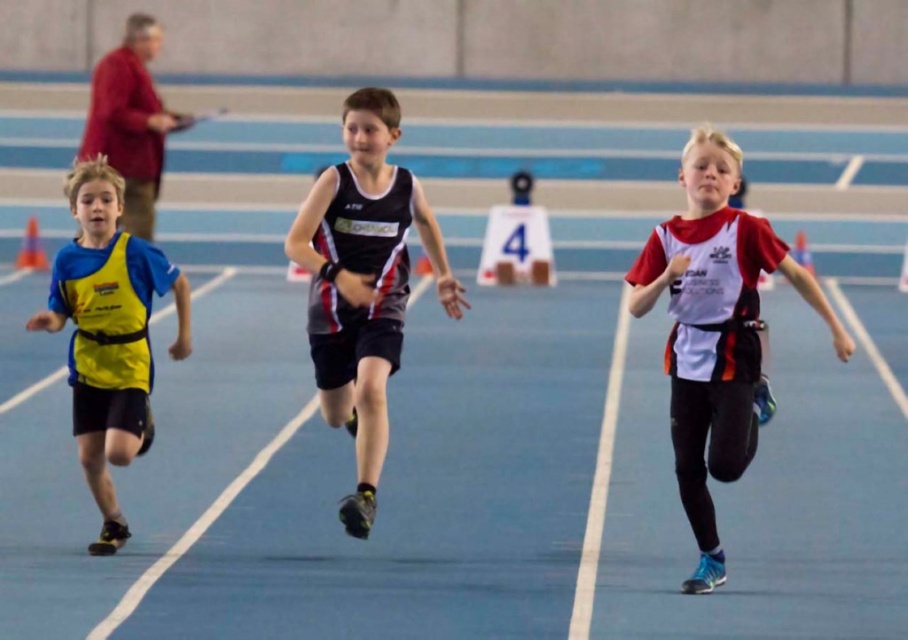
You are a photographer positioned at the finish line of the track. You need to capture a photo that includes both the white matte jersey at center and the black matte running suit at center. The camera has a maximum focus range of 1.8 meters. Will you be able to fit both subjects within the camera focus range?

The white matte jersey at center and the black matte running suit at center are 1.74 meters apart from each other. Since the distance between them is less than the camera focus range of 1.8 meters, both subjects can be captured within the focus range.

You are a photographer positioned at the finish line of the indoor track event. You need to capture a clear photo of the athlete in the black matte running suit at center and the athlete in the yellow fabric vest at left. Which athlete will appear larger in your photo?

The black matte running suit at center will appear larger in the photo because it is closer to the viewer than the yellow fabric vest at left.

Based on the photo, you are a photographer at the indoor track event. You need to capture a photo of the white matte jersey at center and the black matte running suit at center. Based on their positions, which one is closer to the camera?

The white matte jersey at center is positioned under the black matte running suit at center, so the black matte running suit at center is closer to the camera.